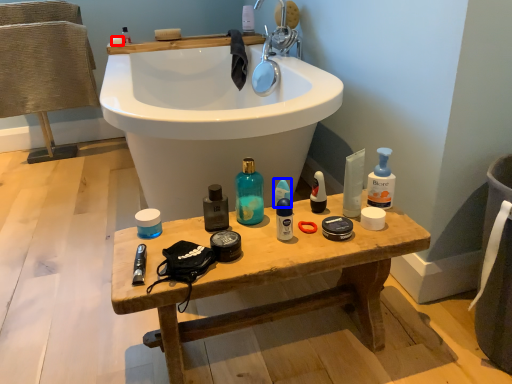
Question: Which point is further to the camera, soap (highlighted by a red box) or toiletry (highlighted by a blue box)?

Choices:
 (A) soap
 (B) toiletry

Answer: (A)